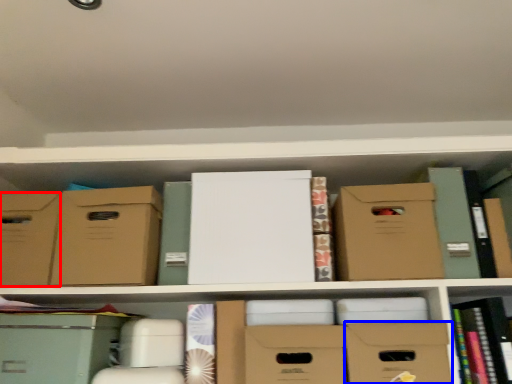
Question: Which of the following is the farthest to the observer, storage box (highlighted by a red box) or storage box (highlighted by a blue box)?

Choices:
 (A) storage box
 (B) storage box

Answer: (A)